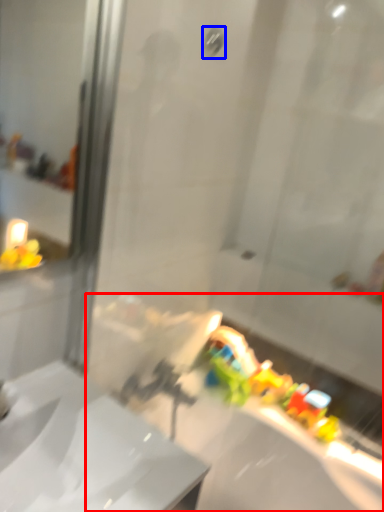
Question: Which of the following is the closest to the observer, bath (highlighted by a red box) or shower (highlighted by a blue box)?

Choices:
 (A) bath
 (B) shower

Answer: (A)